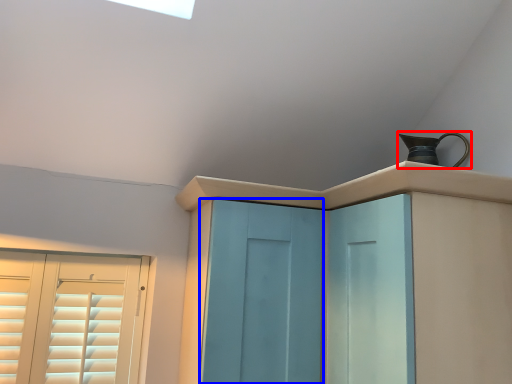
Question: Which point is closer to the camera, jug (highlighted by a red box) or screen door (highlighted by a blue box)?

Choices:
 (A) jug
 (B) screen door

Answer: (B)